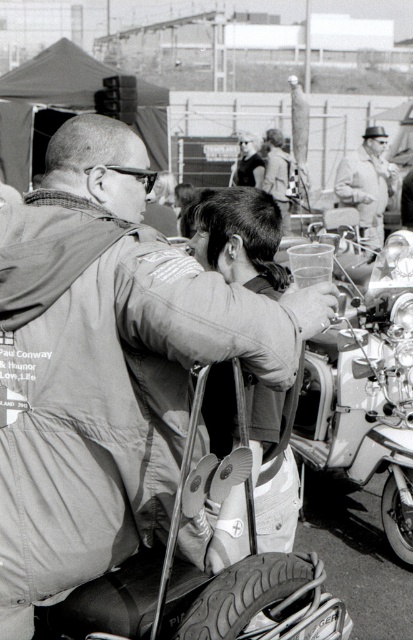
Question: Estimate the real-world distances between objects in this image. Which object is farther from the matte leather jacket at center?

Choices:
 (A) metallic chrome motorcycle at center
 (B) smooth beige jacket at center
 (C) rubber/soft tire at lower right

Answer: (B)

Question: Does matte leather jacket at center come behind rubber/textured tire at lower center?

Choices:
 (A) no
 (B) yes

Answer: (A)

Question: Which of the following is the farthest from the observer?

Choices:
 (A) matte leather jacket at center
 (B) rubber/soft tire at lower right
 (C) metallic chrome motorcycle at center

Answer: (C)

Question: Can you confirm if rubber/textured tire at lower center is positioned to the left of rubber/soft tire at lower right?

Choices:
 (A) no
 (B) yes

Answer: (B)

Question: Is smooth beige jacket at center wider than rubber/soft tire at lower right?

Choices:
 (A) yes
 (B) no

Answer: (A)

Question: Which object is the closest to the rubber/textured tire at lower center?

Choices:
 (A) smooth beige jacket at center
 (B) rubber/soft tire at lower right
 (C) metallic chrome motorcycle at center
 (D) matte leather jacket at center

Answer: (D)